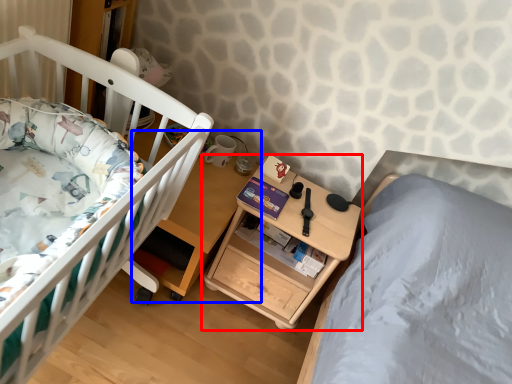
Question: Which of the following is the closest to the observer, nightstand (highlighted by a red box) or table (highlighted by a blue box)?

Choices:
 (A) nightstand
 (B) table

Answer: (B)